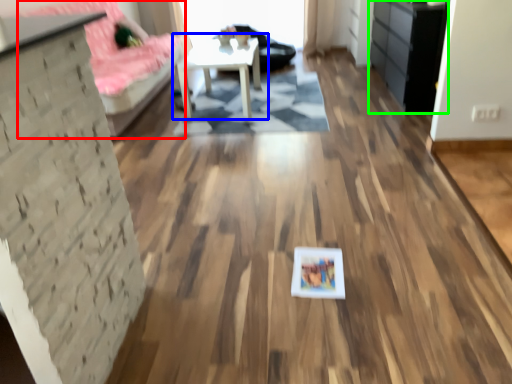
Question: Estimate the real-world distances between objects in this image. Which object is farther from couch (highlighted by a red box), table (highlighted by a blue box) or dresser (highlighted by a green box)?

Choices:
 (A) table
 (B) dresser

Answer: (B)